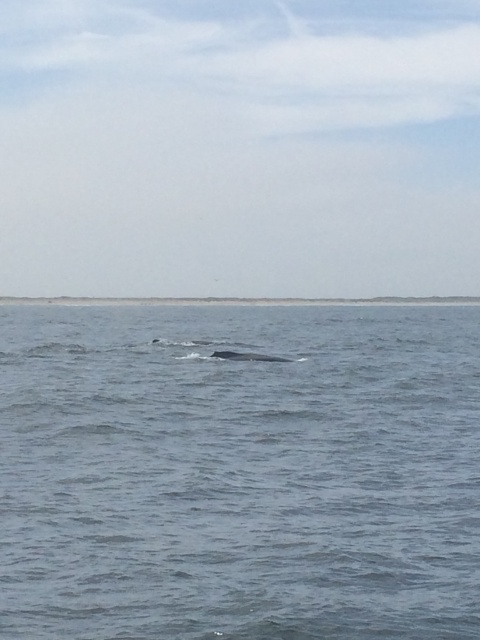
Question: In this image, where is gray matte water at center located relative to gray matte whale at center?

Choices:
 (A) below
 (B) above

Answer: (B)

Question: Is gray matte water at center wider than gray matte whale at center?

Choices:
 (A) no
 (B) yes

Answer: (B)

Question: Which point appears closest to the camera in this image?

Choices:
 (A) (257, 353)
 (B) (167, 371)

Answer: (A)

Question: Which of the following is the closest to the observer?

Choices:
 (A) (229, 358)
 (B) (128, 326)

Answer: (A)

Question: Is gray matte water at center wider than gray matte whale at center?

Choices:
 (A) yes
 (B) no

Answer: (A)